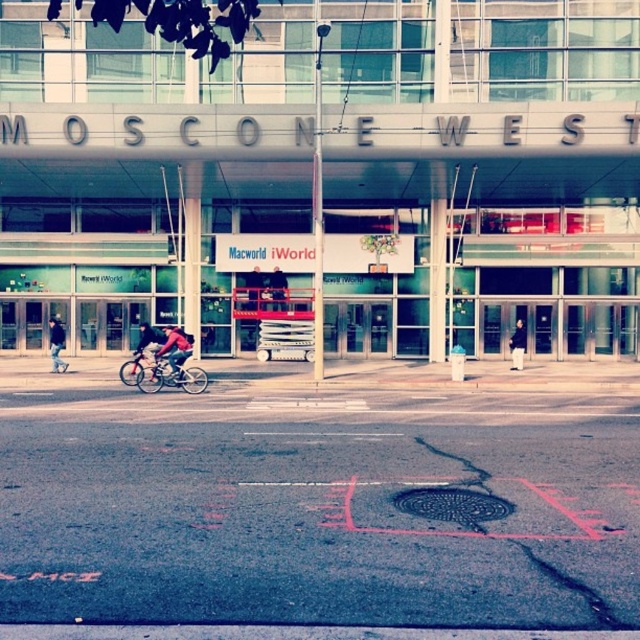
Can you confirm if shiny metallic bicycle at center-left is smaller than dark blue jeans at left?

Correct, shiny metallic bicycle at center-left occupies less space than dark blue jeans at left.

How much distance is there between shiny metallic bicycle at center-left and dark blue jeans at left?

The distance of shiny metallic bicycle at center-left from dark blue jeans at left is 13.52 feet.

Is point (163, 369) farther from viewer compared to point (51, 324)?

No, it is in front of (51, 324).

Where is `shiny metallic bicycle at center-left`? Image resolution: width=640 pixels, height=640 pixels. shiny metallic bicycle at center-left is located at coordinates coord(132,369).

Describe the element at coordinates (168, 376) in the screenshot. I see `silver metallic bicycle at center-left` at that location.

From the picture: Does silver metallic bicycle at center-left have a lesser height compared to red jacket at center?

Correct, silver metallic bicycle at center-left is not as tall as red jacket at center.

Is point (172, 378) more distant than point (168, 348)?

No.

Image resolution: width=640 pixels, height=640 pixels. I want to click on silver metallic bicycle at center-left, so click(168, 376).

Can you confirm if red jacket at center is smaller than shiny metallic bicycle at center-left?

No, red jacket at center is not smaller than shiny metallic bicycle at center-left.

Describe the element at coordinates (176, 349) in the screenshot. I see `red jacket at center` at that location.

What do you see at coordinates (176, 349) in the screenshot? The width and height of the screenshot is (640, 640). I see `red jacket at center` at bounding box center [176, 349].

I want to click on red jacket at center, so click(176, 349).